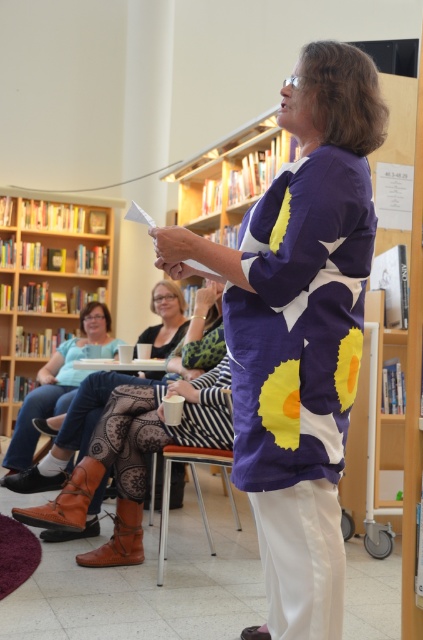
You are standing in the library scene and want to place a small decorative item between the two points marked as point (38, 417) and point (175, 448). Which point should the item be closer to in order to be closer to the viewer?

The item should be closer to point (38, 417) because it is further to the viewer than point (175, 448).